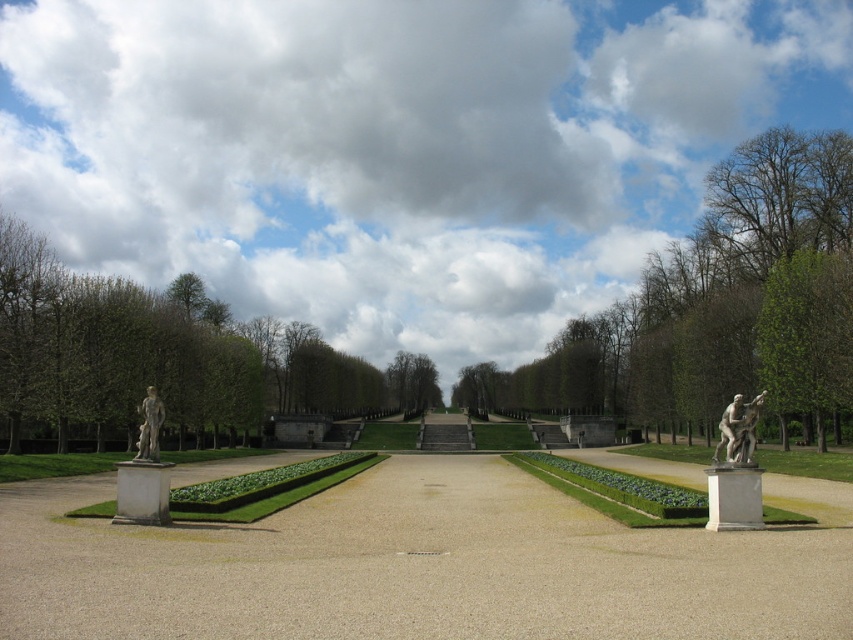
Between point (817, 435) and point (740, 452), which one is positioned behind?

The point (817, 435) is behind.

The width and height of the screenshot is (853, 640). Describe the element at coordinates (807, 333) in the screenshot. I see `green leafy tree at right` at that location.

Identify the location of green leafy tree at right. (807, 333).

Who is more distant from viewer, (242, 524) or (740, 444)?

The point (242, 524) is behind.

Looking at this image, does smooth concrete path at center appear on the right side of silver metallic statue at right?

Incorrect, smooth concrete path at center is not on the right side of silver metallic statue at right.

Describe the element at coordinates (422, 564) in the screenshot. I see `smooth concrete path at center` at that location.

Find the location of `smooth concrete path at center`. smooth concrete path at center is located at coordinates [x=422, y=564].

From the picture: Between smooth concrete path at center and matte gray statue at left, which one has less height?

Standing shorter between the two is matte gray statue at left.

Is point (610, 605) in front of point (149, 397)?

Yes, it is in front of point (149, 397).

What do you see at coordinates (422, 564) in the screenshot?
I see `smooth concrete path at center` at bounding box center [422, 564].

In order to click on smooth concrete path at center in this screenshot , I will do `click(422, 564)`.